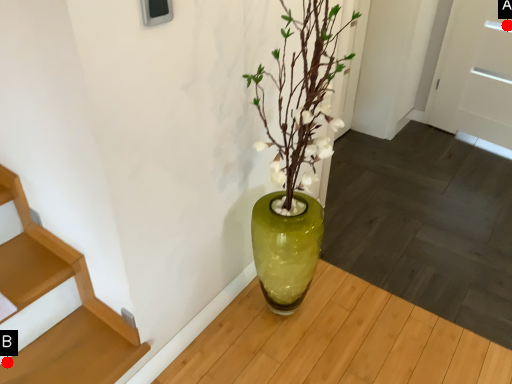
Question: Two points are circled on the image, labeled by A and B beside each circle. Which point is further to the camera?

Choices:
 (A) A is further
 (B) B is further

Answer: (A)